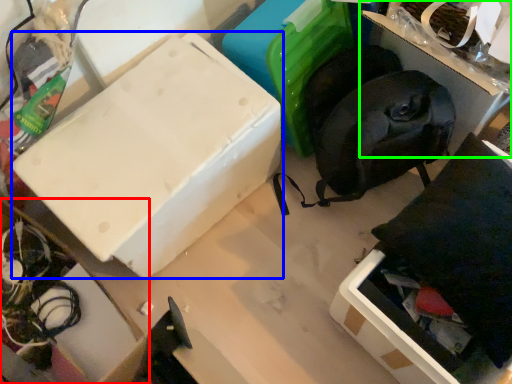
Question: Which object is the farthest from cardboard box (highlighted by a red box)? Choose among these: box (highlighted by a blue box) or storage box (highlighted by a green box).

Choices:
 (A) box
 (B) storage box

Answer: (B)